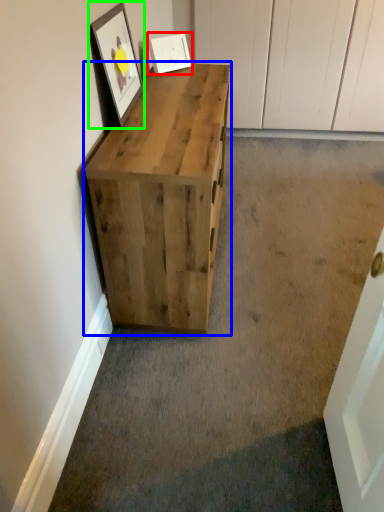
Question: Which object is positioned closest to picture frame (highlighted by a red box)? Select from chest of drawers (highlighted by a blue box) and picture frame (highlighted by a green box).

Choices:
 (A) chest of drawers
 (B) picture frame

Answer: (B)